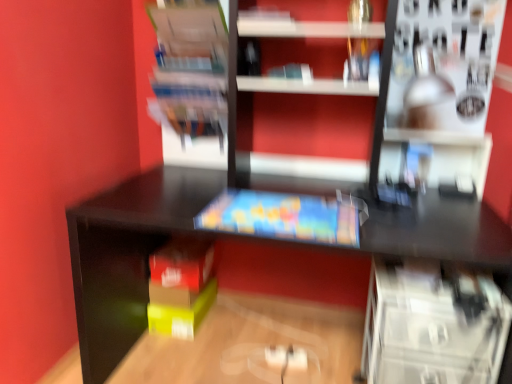
Question: Does point (394, 329) appear closer or farther from the camera than point (181, 119)?

Choices:
 (A) farther
 (B) closer

Answer: (B)

Question: From their relative heights in the image, would you say transparent plastic drawers at lower right, marked as the third shelf in a top-to-bottom arrangement, is taller or shorter than matte plastic books at upper left, which is the third shelf in right-to-left order?

Choices:
 (A) short
 (B) tall

Answer: (B)

Question: Estimate the real-world distances between objects in this image. Which object is farther from the matte plastic book at center?

Choices:
 (A) transparent plastic drawers at lower right, marked as the third shelf in a top-to-bottom arrangement
 (B) satin silver lamp at upper right, the third shelf positioned from the left
 (C) matte plastic books at upper left, which is the third shelf in right-to-left order

Answer: (B)

Question: Considering the real-world distances, which object is closest to the satin silver lamp at upper right, the third shelf positioned from the left?

Choices:
 (A) matte plastic books at upper left, which is the third shelf in right-to-left order
 (B) transparent plastic drawers at lower right, placed as the 2th shelf when sorted from left to right
 (C) matte plastic book at center

Answer: (C)